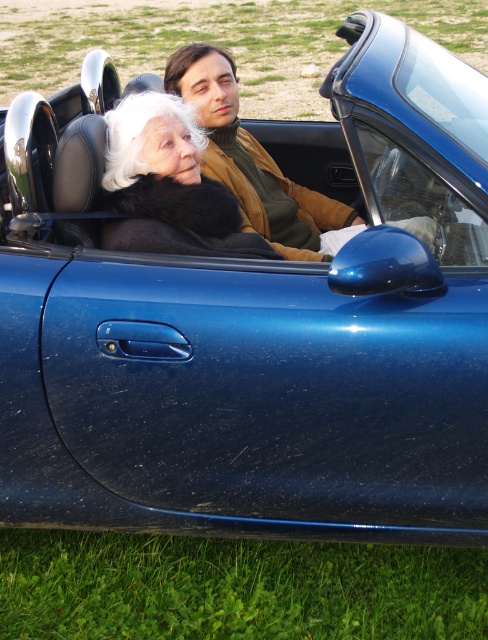
Can you confirm if matte black fur coat at center is taller than brown leather jacket at center?

No.

Can you confirm if matte black fur coat at center is thinner than brown leather jacket at center?

Indeed, matte black fur coat at center has a lesser width compared to brown leather jacket at center.

Locate an element on the screen. This screenshot has width=488, height=640. matte black fur coat at center is located at coordinates (167, 186).